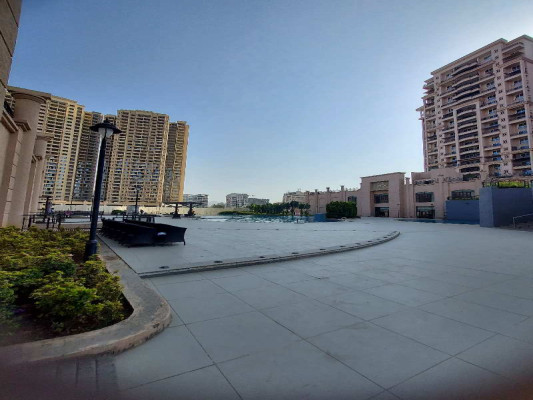
Identify the location of entrance door. Image resolution: width=533 pixels, height=400 pixels. (383, 212), (426, 214).